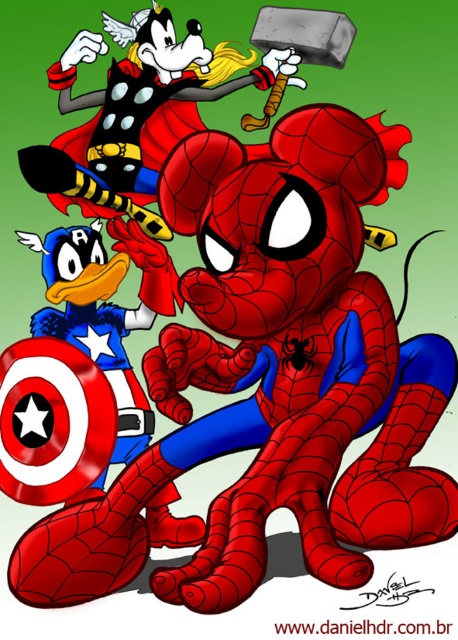
Based on the photo, who is positioned more to the right, shiny metallic hammer at upper center or shiny metallic shield at lower left?

Positioned to the right is shiny metallic hammer at upper center.

Who is more distant from viewer, (141, 168) or (90, 250)?

The point (141, 168) is more distant.

What do you see at coordinates (134, 108) in the screenshot?
I see `shiny metallic hammer at upper center` at bounding box center [134, 108].

The image size is (458, 640). I want to click on shiny metallic hammer at upper center, so click(x=134, y=108).